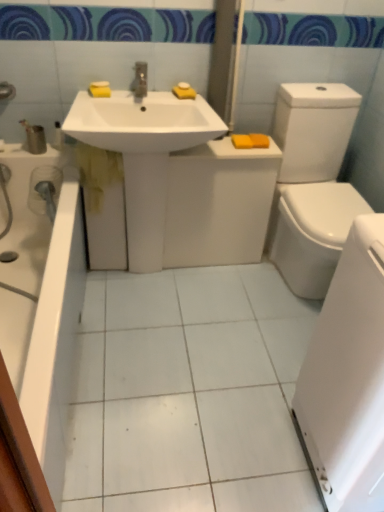
Question: In the image, is yellow sponge at upper center, arranged as the third soap when viewed from the left, on the left side or the right side of orange matte bar of soap at upper right, which is the 4th soap in left-to-right order?

Choices:
 (A) left
 (B) right

Answer: (A)

Question: From the image's perspective, is yellow sponge at upper center, arranged as the third soap when viewed from the left, above or below orange matte bar of soap at upper right, marked as the second soap in a right-to-left arrangement?

Choices:
 (A) above
 (B) below

Answer: (A)

Question: Which object is positioned closest to the white glossy sink at center?

Choices:
 (A) yellow sponge at upper left, the 5th soap in the right-to-left sequence
 (B) white glossy towel at lower right
 (C) matte silver faucet at center
 (D) yellow matte soap at right, the fifth soap from the left
 (E) orange matte bar of soap at upper right, marked as the second soap in a right-to-left arrangement

Answer: (C)

Question: Which object is positioned farthest from the yellow sponge at upper center, the fourth soap positioned from the right?

Choices:
 (A) yellow sponge at upper center, arranged as the third soap when viewed from the left
 (B) yellow sponge at upper left, the 5th soap in the right-to-left sequence
 (C) white glossy towel at lower right
 (D) orange matte bar of soap at upper right, marked as the second soap in a right-to-left arrangement
 (E) yellow matte soap at right, marked as the first soap in a right-to-left arrangement

Answer: (C)